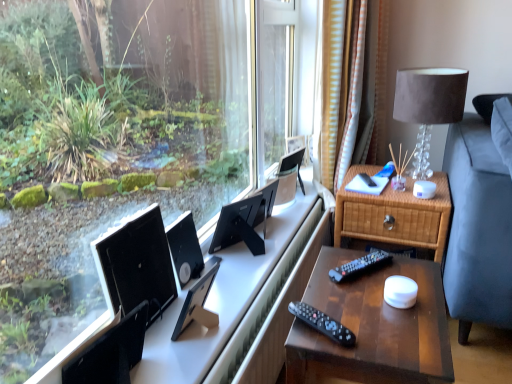
Where is `vacant space situated on the left part of black plastic remote control at lower center, acting as the 2th remote control starting from the front`? vacant space situated on the left part of black plastic remote control at lower center, acting as the 2th remote control starting from the front is located at coordinates (324, 280).